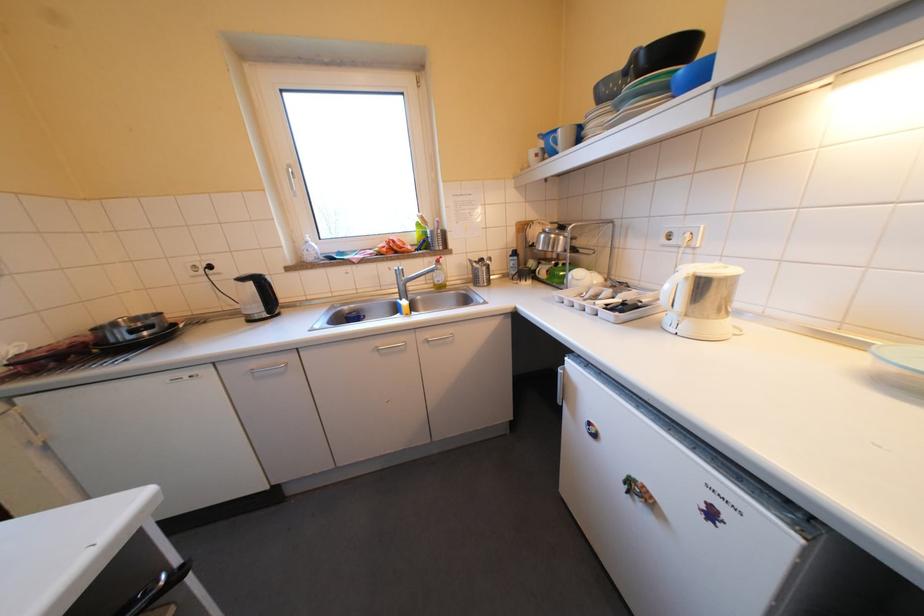
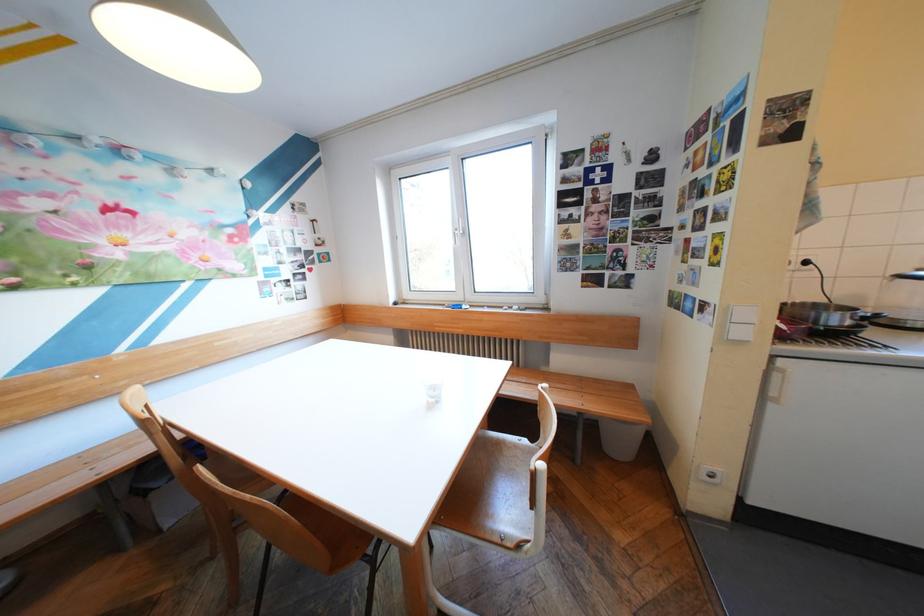
Find the pixel in the second image that matches pixel 217 257 in the first image.

(816, 252)